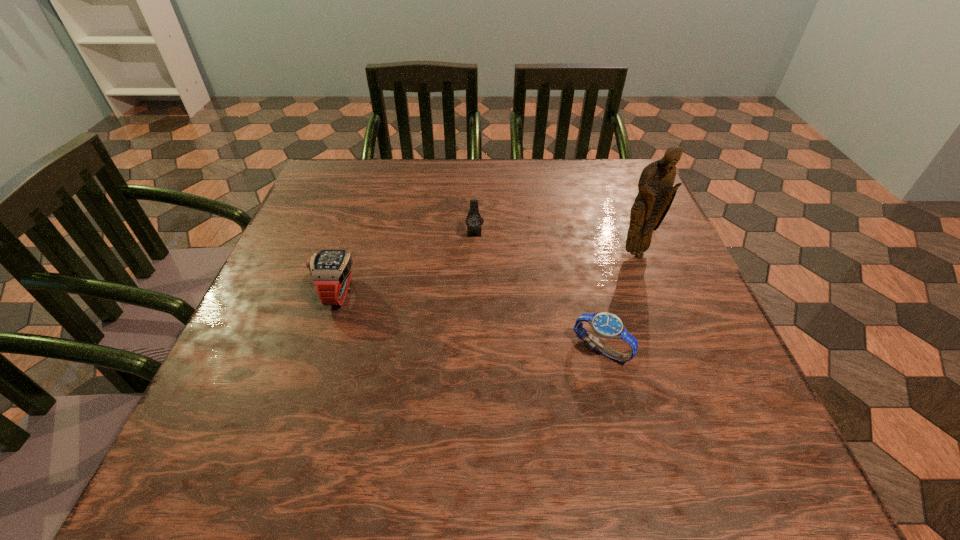
Locate an element on the screen. This screenshot has height=540, width=960. the rightmost object is located at coordinates (656, 193).

Where is `the second farthest object`? This screenshot has width=960, height=540. the second farthest object is located at coordinates (656, 193).

Locate an element on the screen. the leftmost object is located at coordinates (331, 269).

The height and width of the screenshot is (540, 960). I want to click on the third farthest object, so click(331, 269).

Where is `the farthest watch`? the farthest watch is located at coordinates (473, 220).

Find the location of a particular element. the farthest object is located at coordinates (473, 220).

Locate an element on the screen. the shortest watch is located at coordinates (606, 325).

Locate an element on the screen. This screenshot has width=960, height=540. the nearest watch is located at coordinates (606, 325).

The image size is (960, 540). I want to click on vacant area located 0.370m on the front-facing side of the figurine, so click(x=700, y=421).

Locate an element on the screen. blank space located on the front of the second nearest watch is located at coordinates (302, 404).